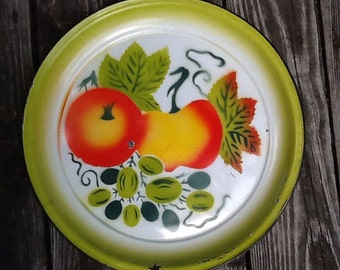
Identify the location of green plate edge. The width and height of the screenshot is (340, 270). (302, 157).